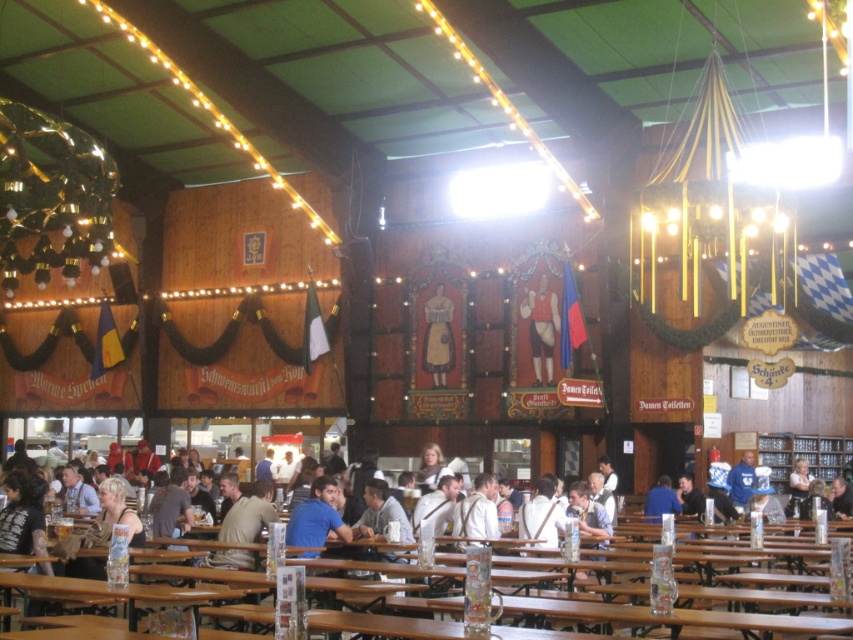
Is light brown wooden table at lower center closer to the viewer compared to blue fleece jacket at center?

That is True.

Is light brown wooden table at lower center further to camera compared to blue fleece jacket at center?

No.

Is point (527, 621) positioned before point (733, 490)?

Yes, point (527, 621) is in front of point (733, 490).

I want to click on light brown wooden table at lower center, so click(647, 598).

How distant is wooden figure at center from blue fleece jacket at center?

The distance of wooden figure at center from blue fleece jacket at center is 20.89 meters.

Is point (437, 289) less distant than point (746, 452)?

That is False.

The image size is (853, 640). Identify the location of wooden figure at center. (438, 337).

Does matte red leather jacket at center have a smaller size compared to wooden figure at center?

No.

Image resolution: width=853 pixels, height=640 pixels. In order to click on matte red leather jacket at center in this screenshot , I will do `click(541, 326)`.

Who is more distant from viewer, (534, 358) or (436, 289)?

Positioned behind is point (436, 289).

I want to click on matte red leather jacket at center, so click(x=541, y=326).